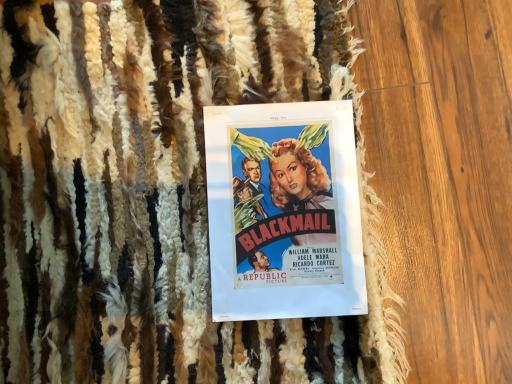
Where is `free space above vivid paper poster at center (from a real-world perspective)`? The image size is (512, 384). free space above vivid paper poster at center (from a real-world perspective) is located at coordinates (284, 204).